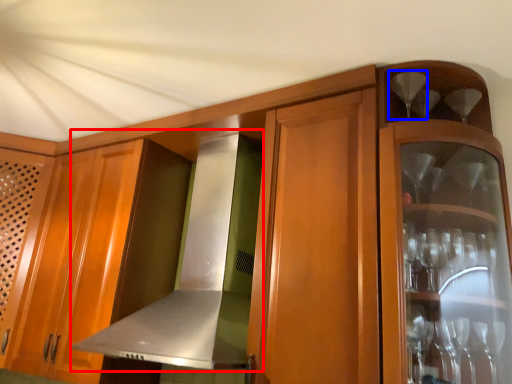
Question: Which of the following is the farthest to the observer, exhaust hood (highlighted by a red box) or wine glass (highlighted by a blue box)?

Choices:
 (A) exhaust hood
 (B) wine glass

Answer: (B)